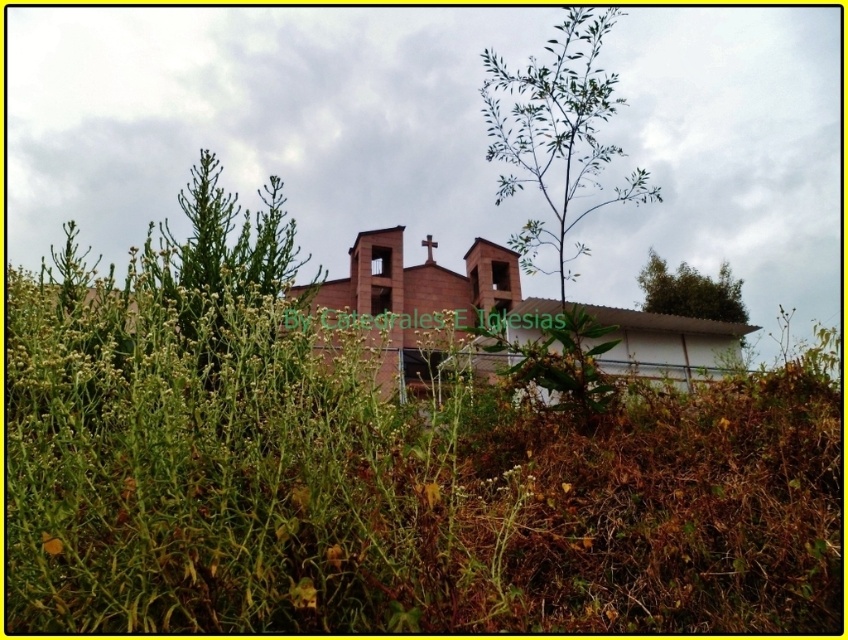
Question: Does green leafy plant at left appear over green leafy tree at upper right?

Choices:
 (A) yes
 (B) no

Answer: (B)

Question: Does green leafy plant at center have a greater width compared to green leafy plant at left?

Choices:
 (A) yes
 (B) no

Answer: (B)

Question: Which object is the farthest from the red brick church at center?

Choices:
 (A) green leafy plant at left
 (B) green leafy tree at upper right
 (C) green leafy plant at center

Answer: (B)

Question: Which point appears farthest from the camera in this image?

Choices:
 (A) (428, 237)
 (B) (706, 312)
 (C) (494, 120)
 (D) (232, 289)

Answer: (B)

Question: Which of these objects is positioned closest to the red brick church at center?

Choices:
 (A) green leafy plant at left
 (B) green leafy tree at upper right
 (C) green leafy plant at center

Answer: (C)

Question: Can you confirm if red brick church at center is wider than green leafy plant at left?

Choices:
 (A) yes
 (B) no

Answer: (A)